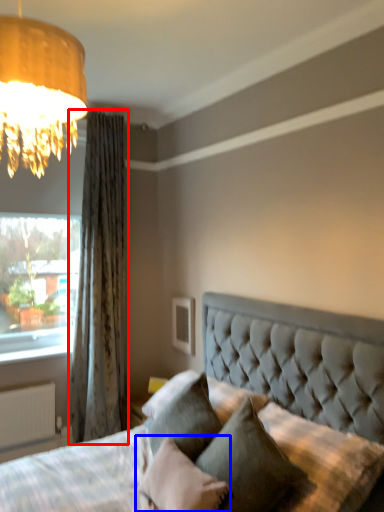
Question: Among these objects, which one is nearest to the camera, curtain (highlighted by a red box) or pillow (highlighted by a blue box)?

Choices:
 (A) curtain
 (B) pillow

Answer: (B)